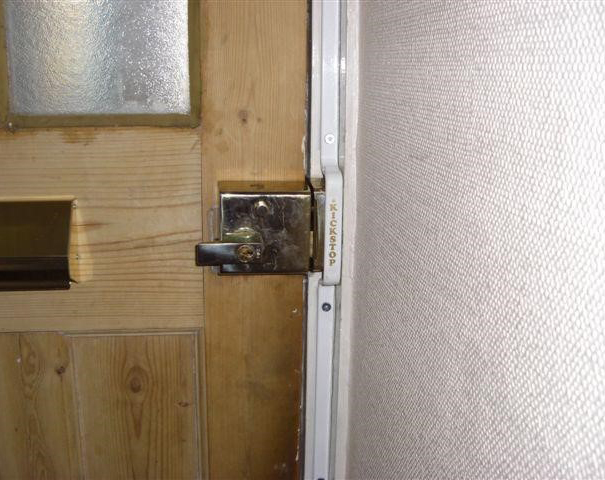
Locate an element on the screen. The height and width of the screenshot is (480, 605). lock is located at coordinates (296, 236).